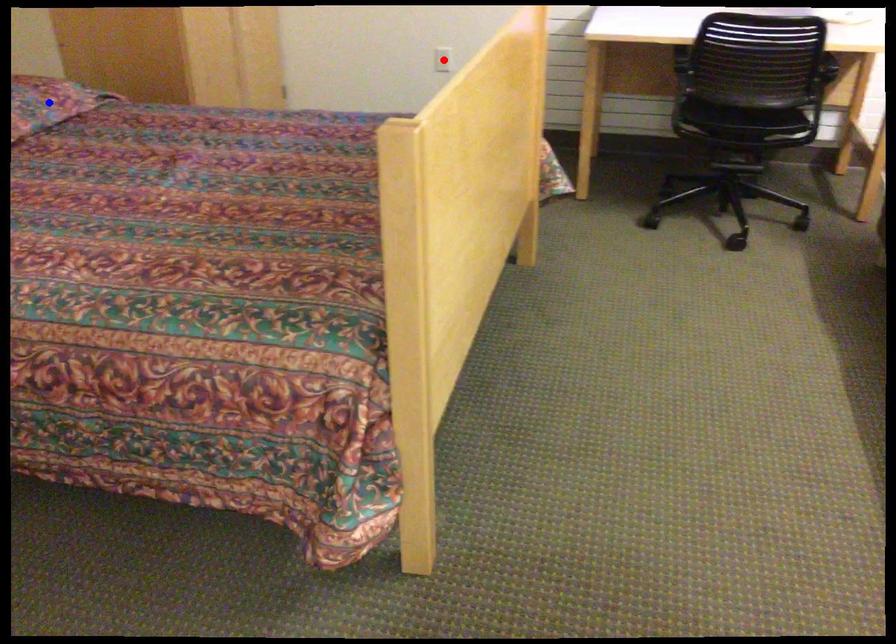
Question: Which of the two points in the image is closer to the camera?

Choices:
 (A) Blue point is closer.
 (B) Red point is closer.

Answer: (A)